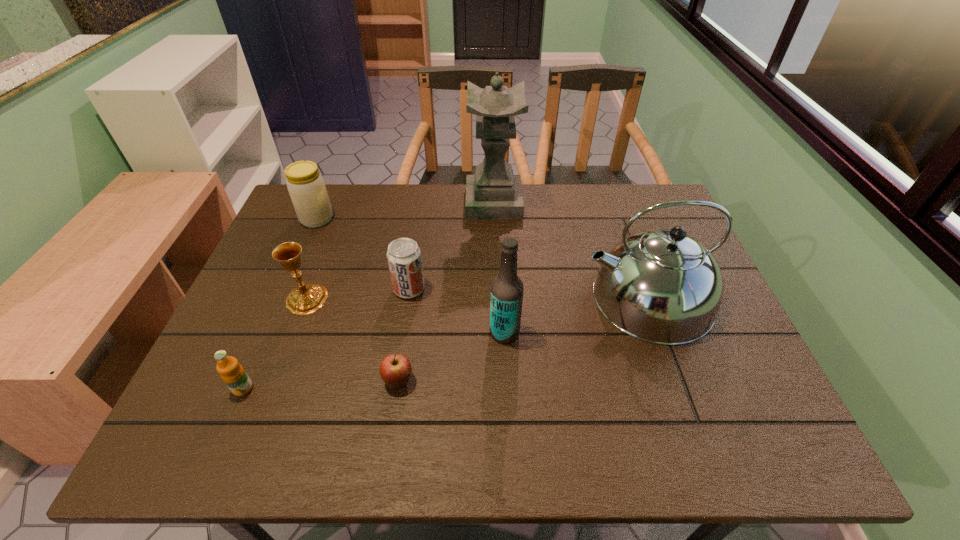
Locate an element on the screen. This screenshot has height=540, width=960. vacant position located 0.090m on the label of the second shortest object is located at coordinates click(x=222, y=439).

Where is `vacant position located 0.130m on the front of the apple`? vacant position located 0.130m on the front of the apple is located at coordinates (387, 456).

You are a GUI agent. You are given a task and a screenshot of the screen. Output one action in this format:
    pyautogui.click(x=<x>, y=<y>)
    Task: Click on the sculpture at the far edge
    Image resolution: width=960 pixels, height=540 pixels.
    Given the screenshot: What is the action you would take?
    pyautogui.click(x=493, y=193)

Image resolution: width=960 pixels, height=540 pixels. In order to click on jar situated at the far edge in this screenshot , I will do `click(307, 189)`.

Locate an element on the screen. The height and width of the screenshot is (540, 960). jar situated at the left edge is located at coordinates (307, 189).

Find the location of a particular element. chalice positioned at the left edge is located at coordinates (306, 299).

The height and width of the screenshot is (540, 960). Identify the location of orange juice positioned at the left edge. (233, 374).

Where is `object that is at the right edge`? The image size is (960, 540). object that is at the right edge is located at coordinates (661, 286).

At what (x,y) coordinates should I click in order to perform the action: click on object that is at the far left corner. Please return your answer as a coordinate pair (x, y). Looking at the image, I should click on (307, 189).

This screenshot has height=540, width=960. Identify the location of vacant space at the far edge of the desktop. (464, 219).